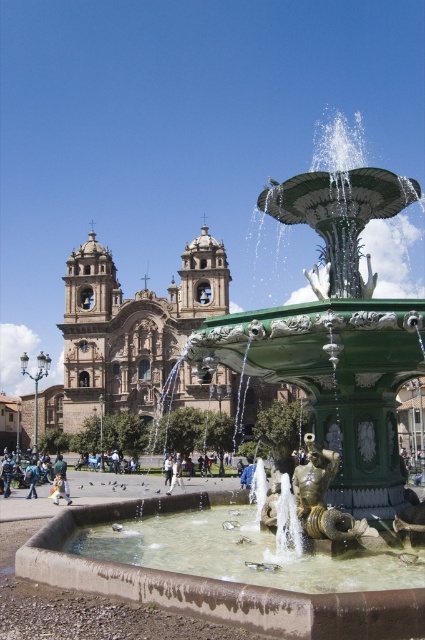
From the picture: Is denim jacket at lower left thinner than white fabric pants at center?

Incorrect, denim jacket at lower left's width is not less than white fabric pants at center's.

Who is shorter, denim jacket at lower left or white fabric pants at center?

denim jacket at lower left

In order to click on denim jacket at lower left in this screenshot , I will do (31, 477).

This screenshot has width=425, height=640. I want to click on denim jacket at lower left, so click(x=31, y=477).